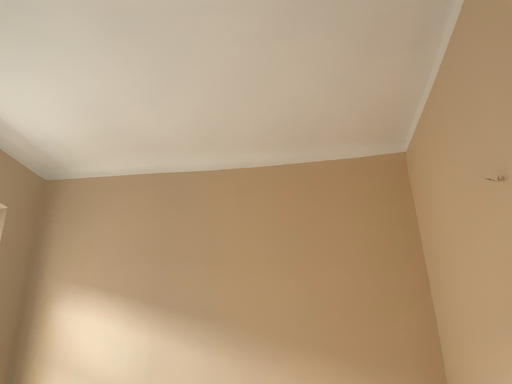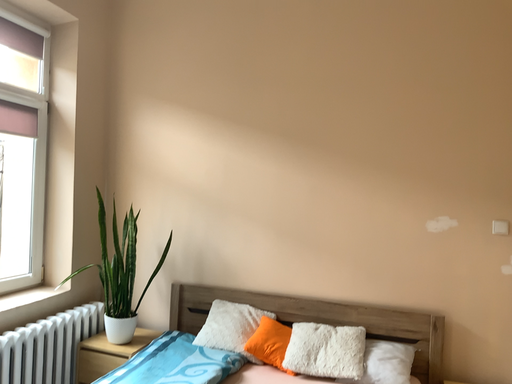
Question: How did the camera likely rotate when shooting the video?

Choices:
 (A) rotated upward
 (B) rotated downward

Answer: (B)